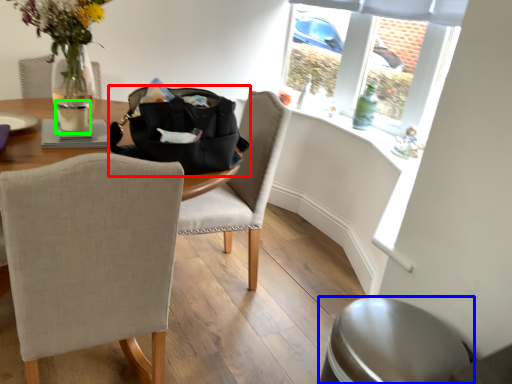
Question: Which object is positioned closest to handbag (highlighted by a red box)? Select from swivel chair (highlighted by a blue box) and beverage (highlighted by a green box).

Choices:
 (A) swivel chair
 (B) beverage

Answer: (B)